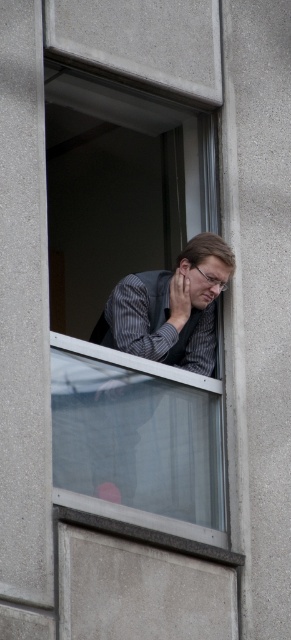
Question: Which object appears farthest from the camera in this image?

Choices:
 (A) clear glass window at center
 (B) matte gray vest at center

Answer: (B)

Question: Does clear glass window at center appear on the right side of matte gray vest at center?

Choices:
 (A) yes
 (B) no

Answer: (B)

Question: Among these objects, which one is farthest from the camera?

Choices:
 (A) clear glass window at center
 (B) matte gray vest at center

Answer: (B)

Question: Does clear glass window at center lie behind matte gray vest at center?

Choices:
 (A) yes
 (B) no

Answer: (B)

Question: Can you confirm if clear glass window at center is smaller than matte gray vest at center?

Choices:
 (A) no
 (B) yes

Answer: (A)

Question: Which point appears farthest from the camera in this image?

Choices:
 (A) (109, 326)
 (B) (64, 148)

Answer: (B)